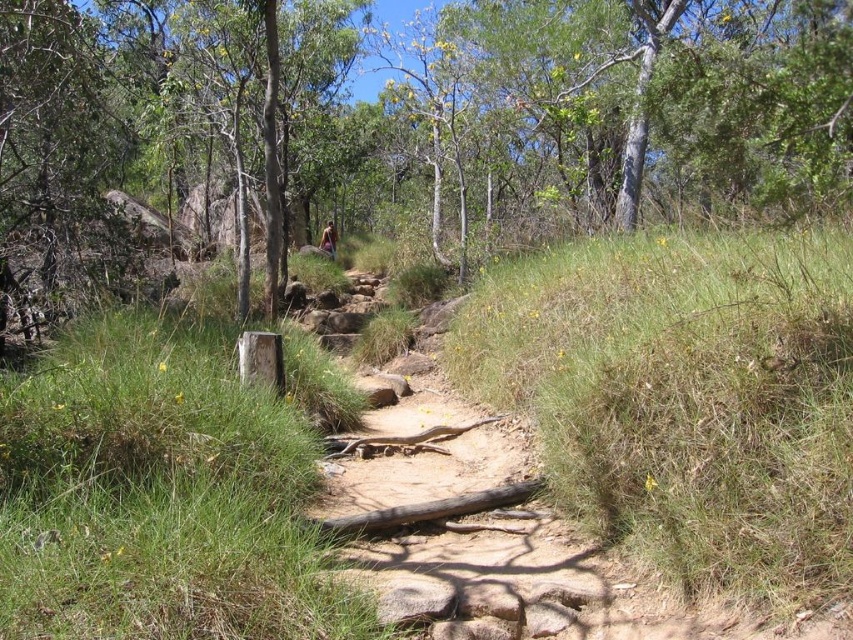
You are a hiker carrying a backpack and see the green leafy tree at center and the brown leather jacket at center. Which object is taller?

The green leafy tree at center is much taller than the brown leather jacket at center.

You are a hiker carrying a backpack and see the green leafy tree at center and the brown leather jacket at center on the trail. Which object takes up more horizontal space in the image?

The green leafy tree at center has a greater width than the brown leather jacket at center, so it takes up more horizontal space in the image.